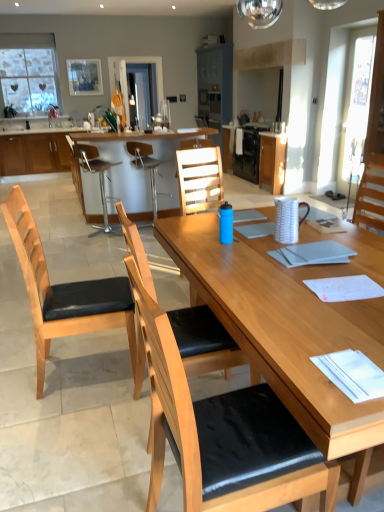
Where is `vacant region in front of light wood chair with black cushion at left, placed as the 3th chair when sorted from back to front`? The image size is (384, 512). vacant region in front of light wood chair with black cushion at left, placed as the 3th chair when sorted from back to front is located at coordinates (71, 419).